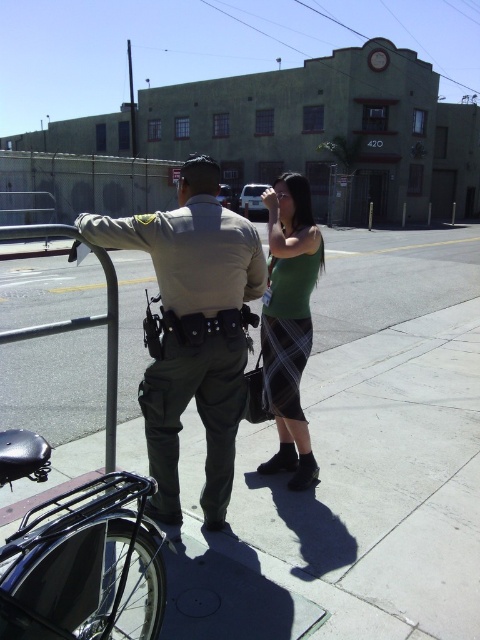
Between matte khaki uniform at center and green plaid skirt at center, which one is positioned higher?

green plaid skirt at center

Between point (200, 257) and point (264, 333), which one is positioned behind?

Positioned behind is point (264, 333).

Where is `matte khaki uniform at center`? matte khaki uniform at center is located at coordinates (192, 330).

Who is positioned more to the left, gray concrete sidewalk at center or green plaid skirt at center?

gray concrete sidewalk at center is more to the left.

Can you confirm if gray concrete sidewalk at center is positioned above green plaid skirt at center?

Yes, gray concrete sidewalk at center is above green plaid skirt at center.

Does point (10, 497) come farther from viewer compared to point (298, 244)?

Yes, it is behind point (298, 244).

You are a GUI agent. You are given a task and a screenshot of the screen. Output one action in this format:
    pyautogui.click(x=<x>, y=<y>)
    Task: Click on the gray concrete sidewalk at center
    The height and width of the screenshot is (640, 480).
    Given the screenshot: What is the action you would take?
    pyautogui.click(x=358, y=465)

Can you confirm if gray concrete sidewalk at center is wider than matte khaki uniform at center?

Yes.

Who is lower down, gray concrete sidewalk at center or matte khaki uniform at center?

matte khaki uniform at center is below.

Locate an element on the screen. The width and height of the screenshot is (480, 640). gray concrete sidewalk at center is located at coordinates (358, 465).